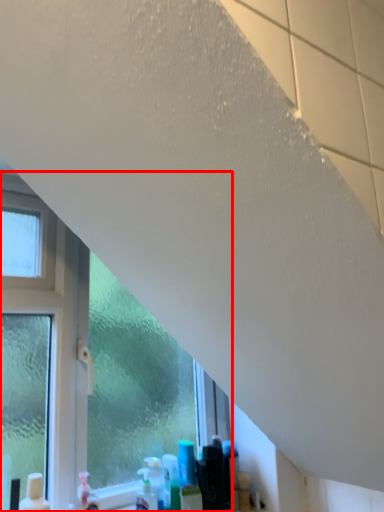
Question: In this image, where is window (annotated by the red box) located relative to cleaning product?

Choices:
 (A) right
 (B) left

Answer: (B)